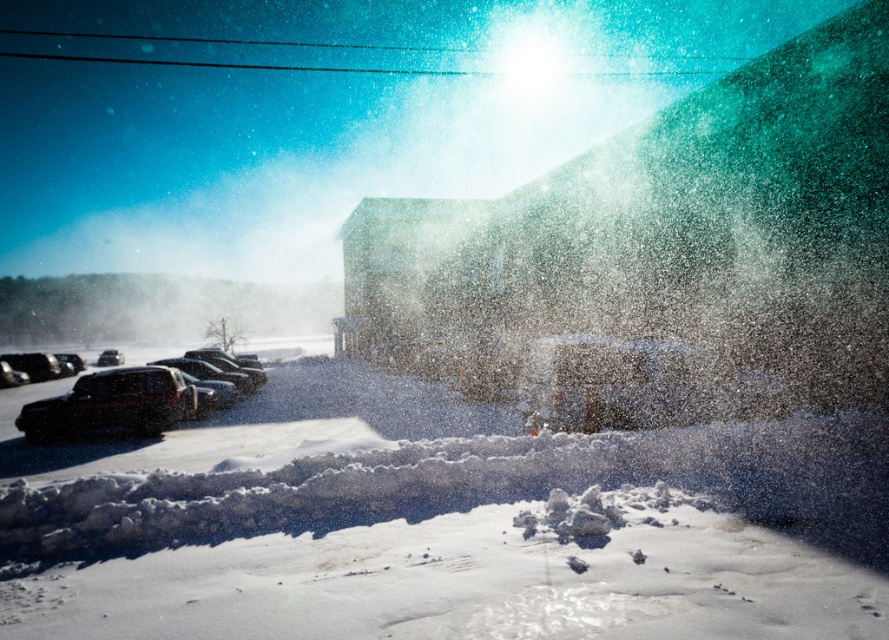
Question: Can you confirm if white fluffy snow at center is positioned to the left of metallic silver car at center?

Choices:
 (A) yes
 (B) no

Answer: (A)

Question: Which point appears closest to the camera in this image?

Choices:
 (A) (119, 352)
 (B) (106, 420)
 (C) (595, 397)
 (D) (802, 456)

Answer: (D)

Question: Which point appears closest to the camera in this image?

Choices:
 (A) (586, 429)
 (B) (97, 365)
 (C) (237, 573)

Answer: (C)

Question: Can you confirm if white fluffy snow at center is positioned above metallic silver car at center?

Choices:
 (A) no
 (B) yes

Answer: (A)

Question: Which of the following is the farthest from the observer?

Choices:
 (A) 111,356
 (B) 557,396
 (C) 385,538

Answer: (A)

Question: Is metallic silver car at center positioned before black matte car at lower left?

Choices:
 (A) no
 (B) yes

Answer: (B)